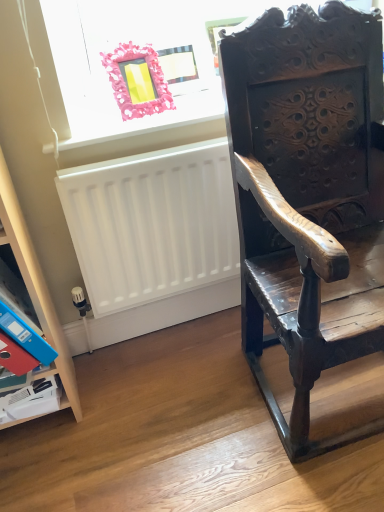
This screenshot has height=512, width=384. Identify the location of vacant space underneath white matte radiator at lower left (from a real-world perspective). (176, 335).